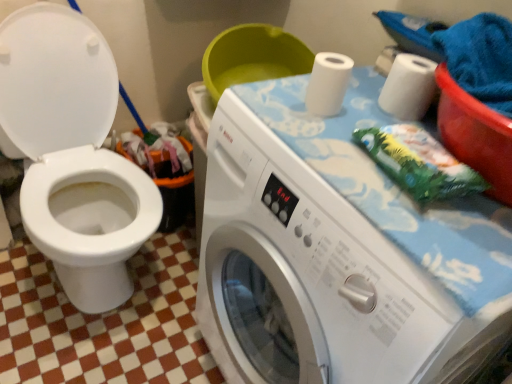
You are a GUI agent. You are given a task and a screenshot of the screen. Output one action in this format:
    pyautogui.click(x=<x>, y=<y>)
    Task: Click on the vacant area that lies to the right of white matte toilet paper at upper right, which is the 1th toilet paper in left-to-right order
    The image size is (512, 384).
    Given the screenshot: What is the action you would take?
    pyautogui.click(x=364, y=114)